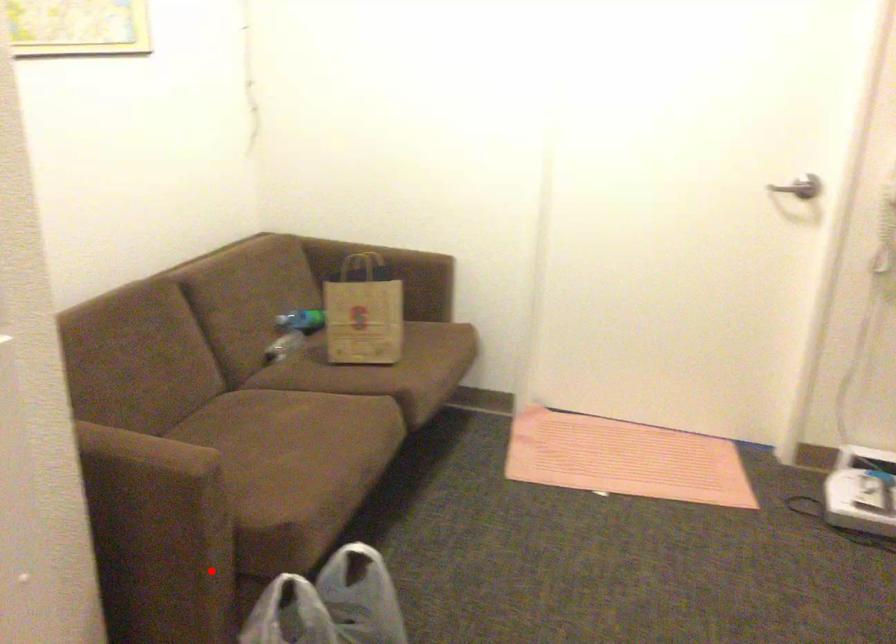
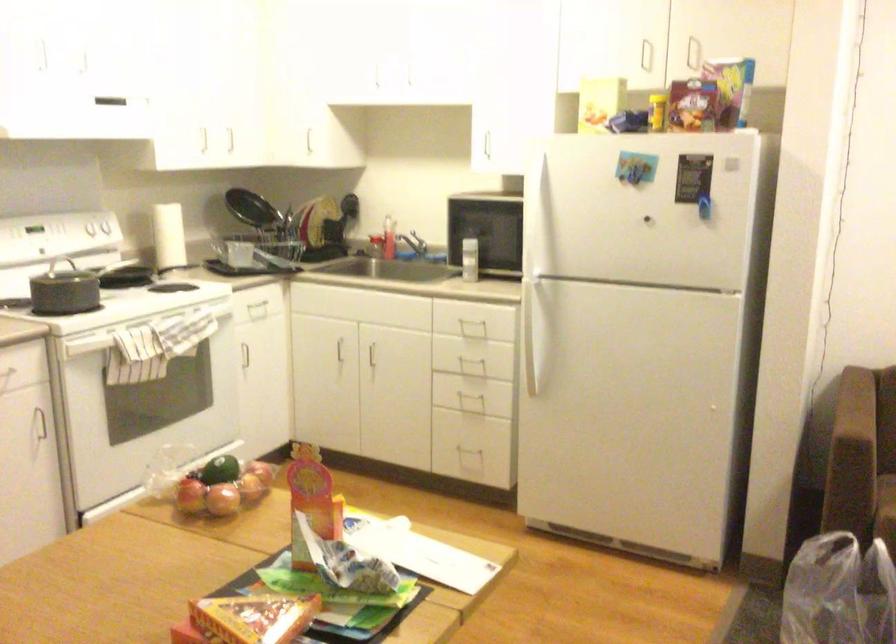
Find the pixel in the second image that matches the highlighted location in the first image.

(863, 513)